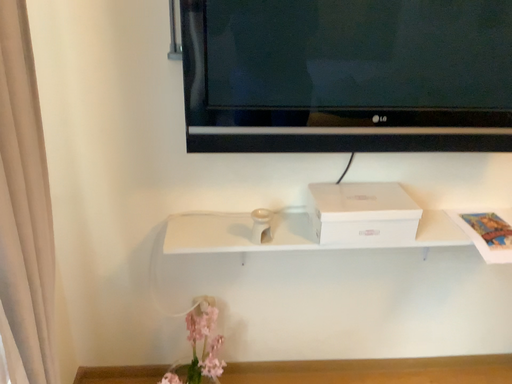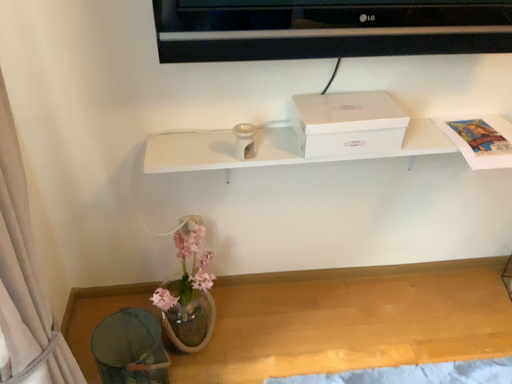
Question: Which way did the camera rotate in the video?

Choices:
 (A) rotated upward
 (B) rotated downward

Answer: (B)